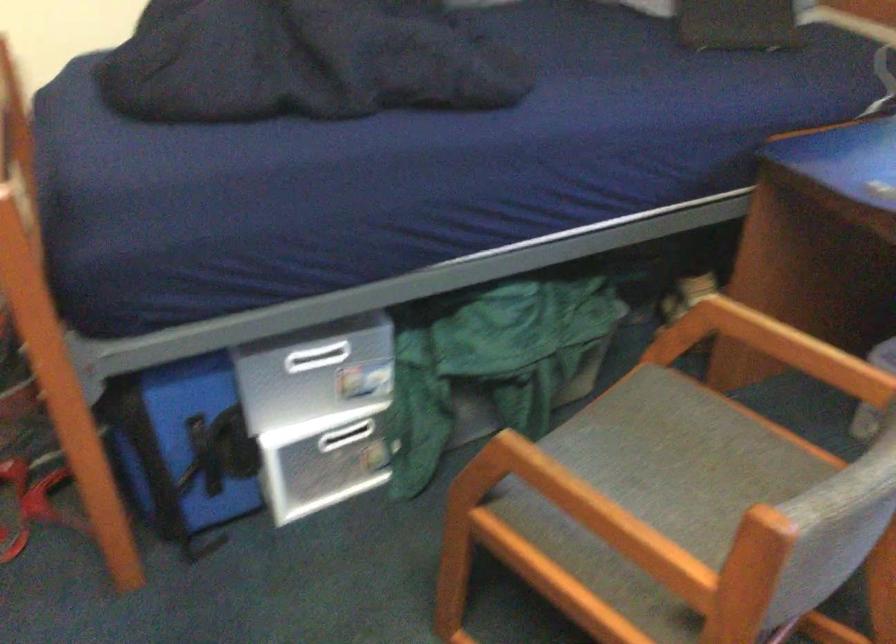
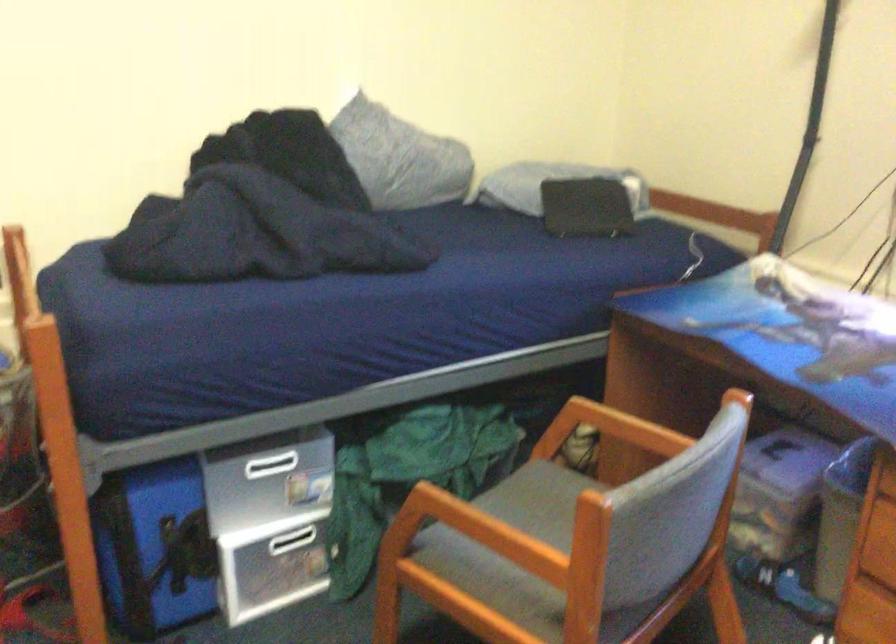
Locate, in the second image, the point that corresponds to (348,436) in the first image.

(291, 540)